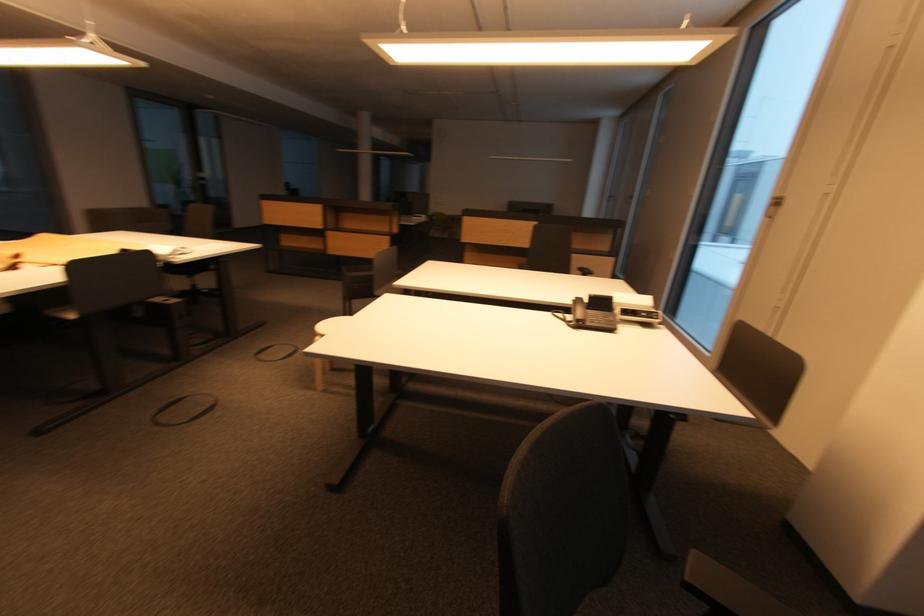
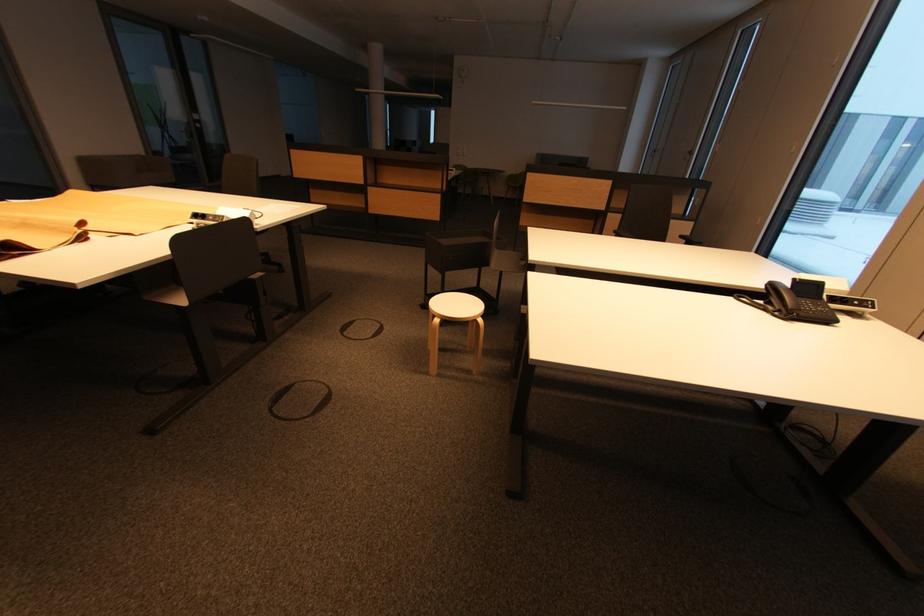
Question: The images are taken continuously from a first-person perspective. In which direction is your viewpoint rotating?

Choices:
 (A) Left
 (B) Right
 (C) Up
 (D) Down

Answer: (D)